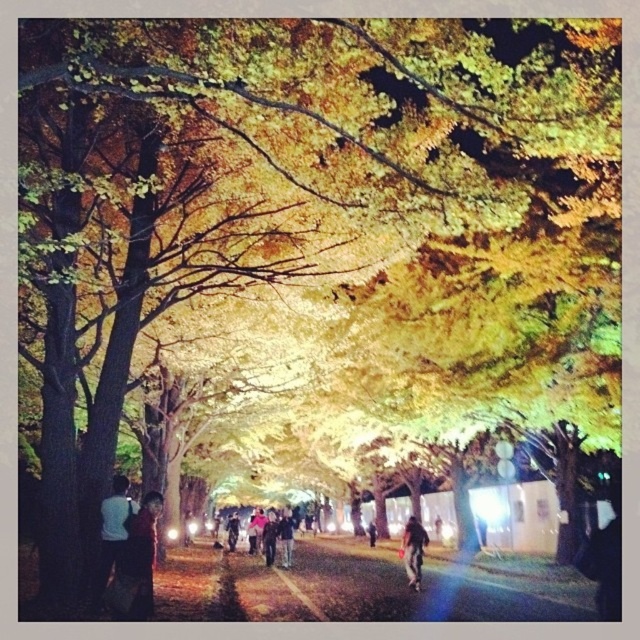
You are standing on the paved pathway in the nighttime scene under the illuminated trees. There are two points marked on the ground ahead of you. Which of the two points, point (132,548) or point (102,564), is closer to you?

Point (132,548) is closer to the viewer than point (102,564).

You are a photographer standing on the pathway and want to capture both the dark brown leather jacket at lower left and the white matte shirt at lower left in the same frame. Given that your camera has a minimum focus distance of 16 inches, will you be able to focus on both subjects clearly?

The dark brown leather jacket at lower left and the white matte shirt at lower left are 16.56 inches apart. Since the distance between them is greater than the camera minimum focus distance of 16 inches, you can focus on both subjects clearly.